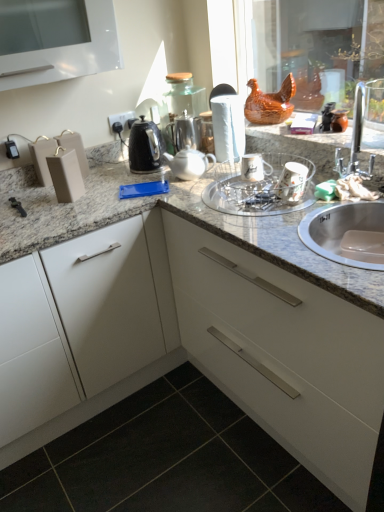
Question: Is granite at center behind black tile at lower left?

Choices:
 (A) yes
 (B) no

Answer: (B)

Question: Is granite at center smaller than black tile at lower left?

Choices:
 (A) no
 (B) yes

Answer: (A)

Question: Is granite at center far from black tile at lower left?

Choices:
 (A) yes
 (B) no

Answer: (B)

Question: Is black tile at lower left surrounded by granite at center?

Choices:
 (A) no
 (B) yes

Answer: (B)

Question: Is granite at center looking in the opposite direction of black tile at lower left?

Choices:
 (A) no
 (B) yes

Answer: (A)

Question: Is white glossy tea pot at center, acting as the 2th tea pot starting from the back, in front of or behind black tile at lower left in the image?

Choices:
 (A) front
 (B) behind

Answer: (B)

Question: Would you say white glossy tea pot at center, which is the first tea pot in front-to-back order, is inside or outside black tile at lower left?

Choices:
 (A) inside
 (B) outside

Answer: (B)

Question: Based on their sizes in the image, would you say white glossy tea pot at center, acting as the 2th tea pot starting from the back, is bigger or smaller than black tile at lower left?

Choices:
 (A) big
 (B) small

Answer: (B)

Question: From the image's perspective, relative to black tile at lower left, is white glossy tea pot at center, acting as the 2th tea pot starting from the back, above or below?

Choices:
 (A) above
 (B) below

Answer: (A)

Question: Is clear glass bowl at center taller or shorter than white matte paper towel at center?

Choices:
 (A) short
 (B) tall

Answer: (A)

Question: Is clear glass bowl at center to the left or to the right of white matte paper towel at center in the image?

Choices:
 (A) left
 (B) right

Answer: (B)

Question: Considering the positions of clear glass bowl at center and white matte paper towel at center in the image, is clear glass bowl at center wider or thinner than white matte paper towel at center?

Choices:
 (A) wide
 (B) thin

Answer: (A)

Question: Considering their positions, is clear glass bowl at center located in front of or behind white matte paper towel at center?

Choices:
 (A) front
 (B) behind

Answer: (A)

Question: In terms of height, does black tile at lower left look taller or shorter compared to white glossy tea pot at center, which is the first tea pot in front-to-back order?

Choices:
 (A) short
 (B) tall

Answer: (A)

Question: Based on their sizes in the image, would you say black tile at lower left is bigger or smaller than white glossy tea pot at center, which is the first tea pot in front-to-back order?

Choices:
 (A) big
 (B) small

Answer: (A)